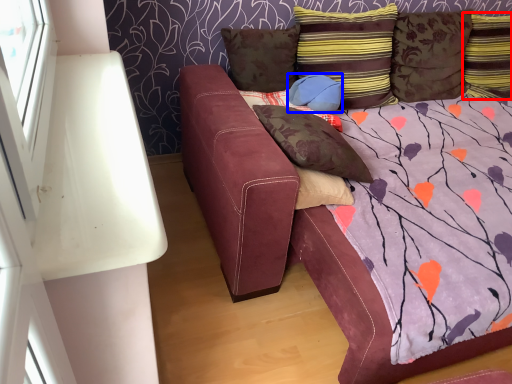
Question: Which of the following is the closest to the observer, pillow (highlighted by a red box) or pillow (highlighted by a blue box)?

Choices:
 (A) pillow
 (B) pillow

Answer: (B)